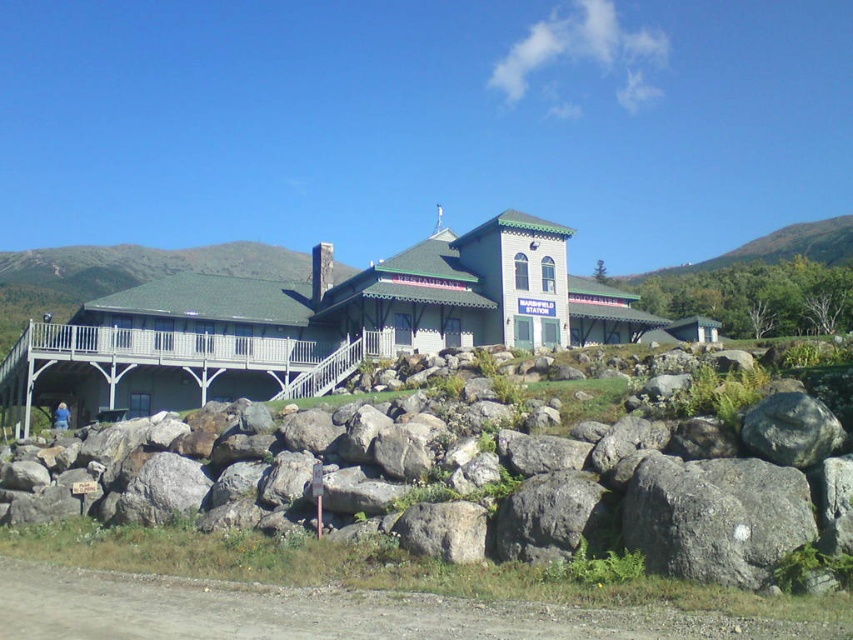
You are standing in front of the building and need to move from the gray rock at center to the wooden porch at center. Considering their sizes, which object will require more space to navigate around?

The wooden porch at center requires more space to navigate around since it is larger than the gray rock at center.